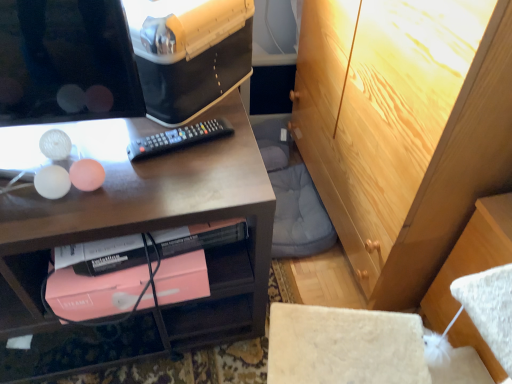
Where is `empty space that is to the right of black plastic remote at center`? Image resolution: width=512 pixels, height=384 pixels. empty space that is to the right of black plastic remote at center is located at coordinates (236, 156).